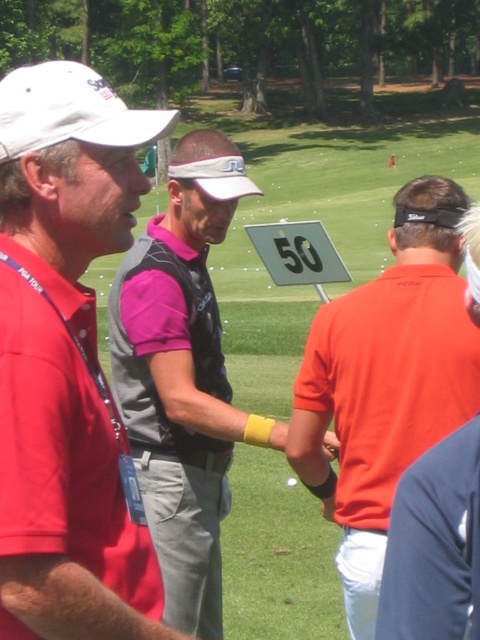
Question: Does white matte cap at upper left have a lesser width compared to orange matte shirt at center?

Choices:
 (A) no
 (B) yes

Answer: (B)

Question: Is white matte cap at upper left to the left of pink fabric shirt at center from the viewer's perspective?

Choices:
 (A) no
 (B) yes

Answer: (A)

Question: Which point is closer to the camera?

Choices:
 (A) (21, 195)
 (B) (347, 438)
 (C) (180, 198)
 (D) (93, 88)

Answer: (A)

Question: Which object is closer to the camera taking this photo?

Choices:
 (A) white matte cap at upper left
 (B) orange matte shirt at center
 (C) pink fabric shirt at center

Answer: (A)

Question: Which object is the farthest from the orange matte shirt at center?

Choices:
 (A) white matte baseball cap at upper left
 (B) white matte cap at upper left
 (C) pink fabric shirt at center

Answer: (B)

Question: In this image, where is white matte cap at upper left located relative to white matte baseball cap at upper left?

Choices:
 (A) right
 (B) left

Answer: (A)